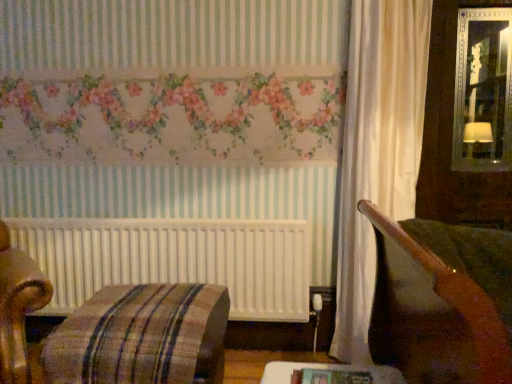
Question: Looking at their shapes, would you say wooden table at lower center is wider or thinner than plaid fabric ottoman at lower left?

Choices:
 (A) thin
 (B) wide

Answer: (A)

Question: From a real-world perspective, is wooden table at lower center positioned above or below plaid fabric ottoman at lower left?

Choices:
 (A) above
 (B) below

Answer: (A)

Question: In terms of height, does wooden table at lower center look taller or shorter compared to plaid fabric ottoman at lower left?

Choices:
 (A) tall
 (B) short

Answer: (B)

Question: Is plaid fabric ottoman at lower left taller or shorter than wooden table at lower center?

Choices:
 (A) tall
 (B) short

Answer: (A)

Question: Does point (89, 362) appear closer or farther from the camera than point (273, 370)?

Choices:
 (A) closer
 (B) farther

Answer: (B)

Question: In terms of width, does plaid fabric ottoman at lower left look wider or thinner when compared to wooden table at lower center?

Choices:
 (A) wide
 (B) thin

Answer: (A)

Question: Considering the relative positions of plaid fabric ottoman at lower left and wooden table at lower center in the image provided, is plaid fabric ottoman at lower left to the left or to the right of wooden table at lower center?

Choices:
 (A) right
 (B) left

Answer: (B)